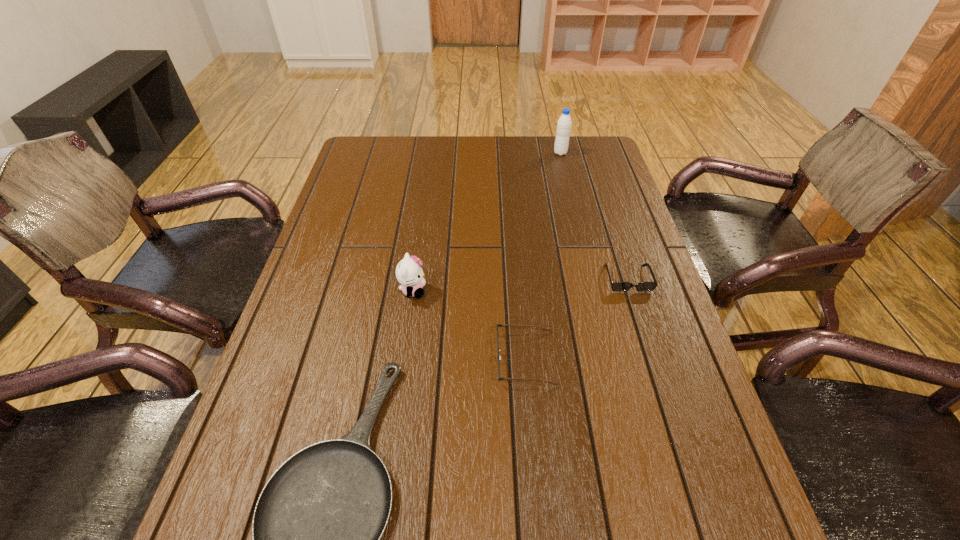
Find the location of `vacant space located 0.400m on the front-facing side of the third object from right to left`. vacant space located 0.400m on the front-facing side of the third object from right to left is located at coordinates (315, 358).

I want to click on object situated at the far edge, so click(564, 123).

Locate an element on the screen. Image resolution: width=960 pixels, height=540 pixels. water bottle that is at the right edge is located at coordinates (564, 123).

Where is `sunglasses located in the right edge section of the desktop`? This screenshot has height=540, width=960. sunglasses located in the right edge section of the desktop is located at coordinates (617, 286).

At what (x,y) coordinates should I click in order to perform the action: click on object present at the far right corner. Please return your answer as a coordinate pair (x, y). Looking at the image, I should click on (564, 123).

Where is `free space at the far edge of the desktop`? The width and height of the screenshot is (960, 540). free space at the far edge of the desktop is located at coordinates (402, 159).

Find the location of a particular element. The image size is (960, 540). blank space at the left edge of the desktop is located at coordinates (354, 266).

At what (x,y) coordinates should I click in order to perform the action: click on free space at the right edge of the desktop. Please return your answer as a coordinate pair (x, y). This screenshot has width=960, height=540. Looking at the image, I should click on (606, 173).

The height and width of the screenshot is (540, 960). What are the coordinates of `free location at the far left corner of the desktop` in the screenshot? It's located at [x=395, y=167].

Identify the location of vacant space that is in between the water bottle and the third object from right to left. This screenshot has width=960, height=540. (543, 255).